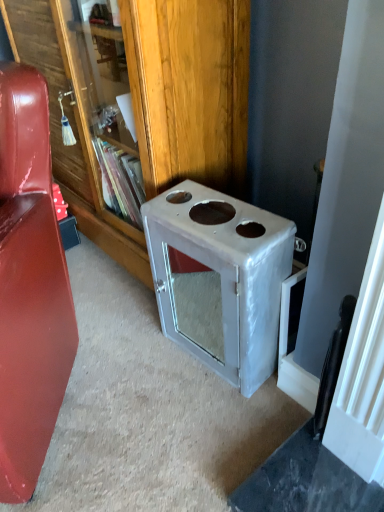
Question: Should I look upward or downward to see white glossy stove at center?

Choices:
 (A) up
 (B) down

Answer: (B)

Question: Does white glossy stove at center appear on the right side of glossy leather couch at left?

Choices:
 (A) yes
 (B) no

Answer: (A)

Question: From the image's perspective, is white glossy stove at center located above glossy leather couch at left?

Choices:
 (A) no
 (B) yes

Answer: (A)

Question: Is white glossy stove at center looking in the opposite direction of glossy leather couch at left?

Choices:
 (A) yes
 (B) no

Answer: (B)

Question: Is white glossy stove at center placed right next to glossy leather couch at left?

Choices:
 (A) yes
 (B) no

Answer: (B)

Question: Is glossy leather couch at left located within white glossy stove at center?

Choices:
 (A) yes
 (B) no

Answer: (B)

Question: Does white glossy stove at center appear on the left side of glossy leather couch at left?

Choices:
 (A) no
 (B) yes

Answer: (A)

Question: Is white glossy stove at center smaller than metallic silver bookcase at center?

Choices:
 (A) yes
 (B) no

Answer: (A)

Question: Considering the relative positions of white glossy stove at center and metallic silver bookcase at center in the image provided, is white glossy stove at center to the right of metallic silver bookcase at center from the viewer's perspective?

Choices:
 (A) yes
 (B) no

Answer: (A)

Question: Would you say white glossy stove at center contains metallic silver bookcase at center?

Choices:
 (A) yes
 (B) no

Answer: (B)

Question: Does white glossy stove at center have a lesser height compared to metallic silver bookcase at center?

Choices:
 (A) no
 (B) yes

Answer: (B)

Question: Is white glossy stove at center outside of metallic silver bookcase at center?

Choices:
 (A) yes
 (B) no

Answer: (A)

Question: Can you confirm if white glossy stove at center is taller than metallic silver bookcase at center?

Choices:
 (A) no
 (B) yes

Answer: (A)

Question: Is metallic silver bookcase at center at the right side of glossy leather couch at left?

Choices:
 (A) no
 (B) yes

Answer: (B)